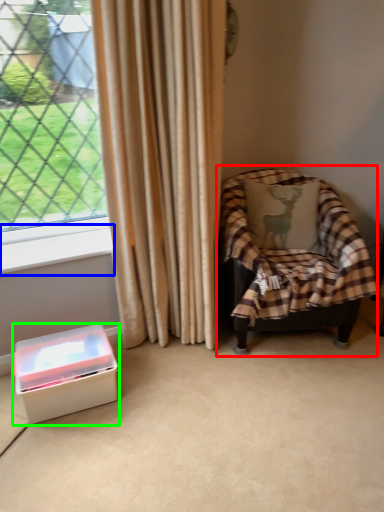
Question: Which object is positioned closest to chair (highlighted by a red box)? Select from window sill (highlighted by a blue box) and box (highlighted by a green box).

Choices:
 (A) window sill
 (B) box

Answer: (A)